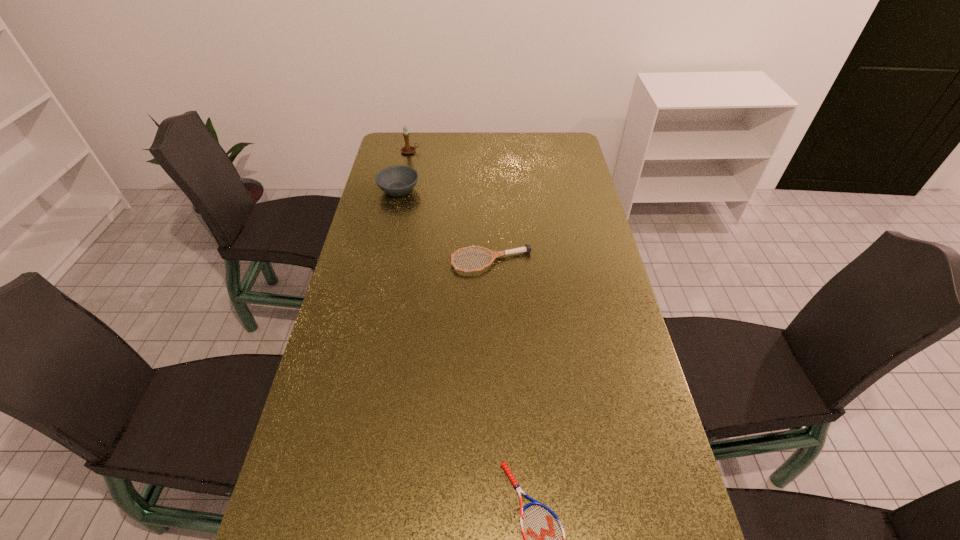
You are a GUI agent. You are given a task and a screenshot of the screen. Output one action in this format:
    pyautogui.click(x=<x>, y=<y>)
    Task: Click on the object that can be found as the third closest to the farthest object
    
    Given the screenshot: What is the action you would take?
    pyautogui.click(x=544, y=538)

Find the location of a particular element. This screenshot has height=540, width=960. free space that satisfies the following two spatial constraints: 1. on the back side of the second shortest object; 2. on the side of the farthest object with the handle is located at coordinates (489, 151).

What are the coordinates of `free region that satisfies the following two spatial constraints: 1. on the side of the farthest object with the handle; 2. on the front side of the second farthest object` in the screenshot? It's located at (402, 190).

Find the location of a particular element. The width and height of the screenshot is (960, 540). blank area in the image that satisfies the following two spatial constraints: 1. on the front side of the taller tennis racket; 2. on the left side of the third nearest object is located at coordinates (383, 262).

The width and height of the screenshot is (960, 540). I want to click on vacant space that satisfies the following two spatial constraints: 1. on the side of the farthest object with the handle; 2. on the right side of the second nearest object, so click(x=387, y=262).